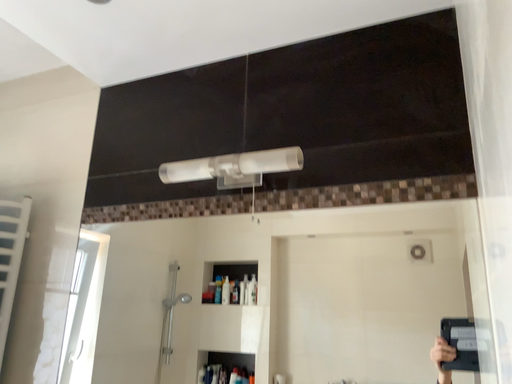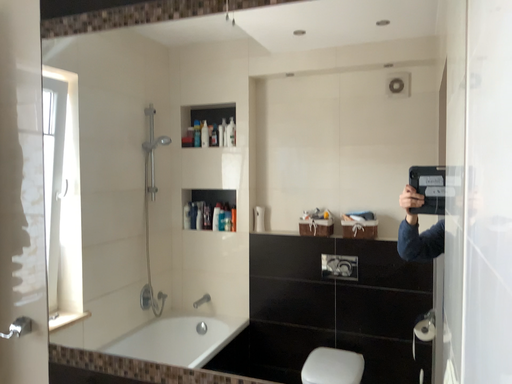
Question: Which way did the camera rotate in the video?

Choices:
 (A) rotated upward
 (B) rotated downward

Answer: (B)